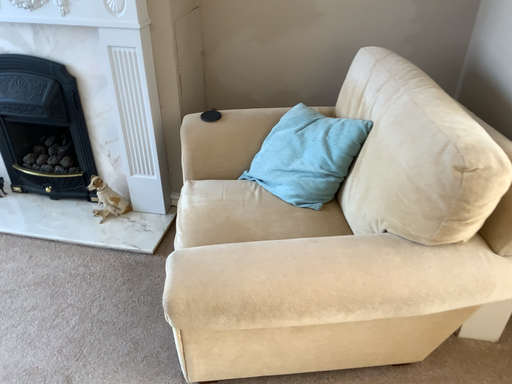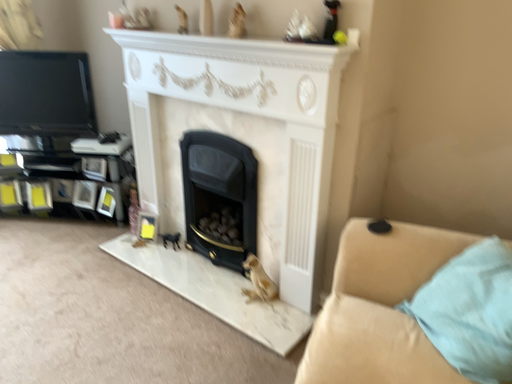
Question: How did the camera likely rotate when shooting the video?

Choices:
 (A) rotated left
 (B) rotated right

Answer: (A)